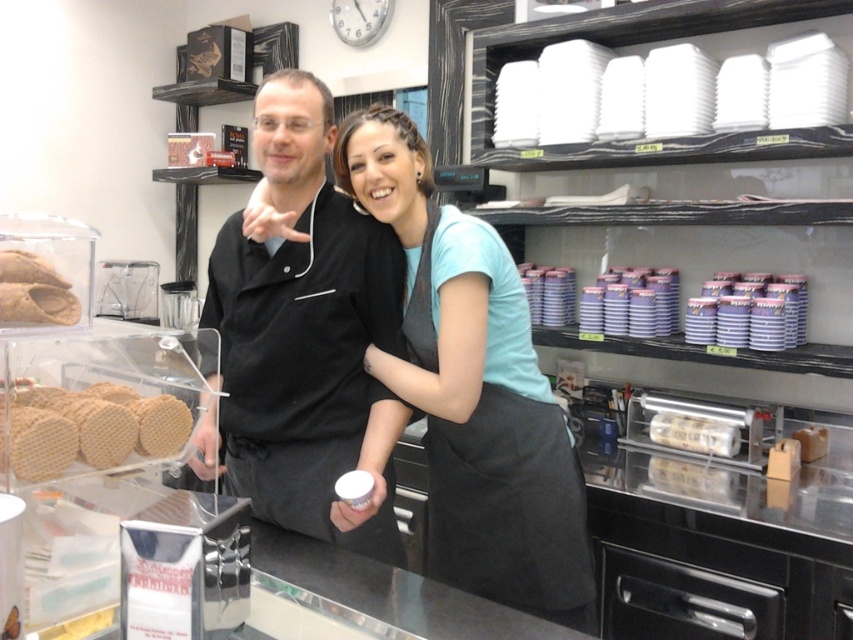
In the scene shown: Can you confirm if golden wafer at left is positioned below brown matte bread at center?

Incorrect, golden wafer at left is not positioned below brown matte bread at center.

Consider the image. Can you confirm if golden wafer at left is shorter than brown matte bread at center?

No, golden wafer at left is not shorter than brown matte bread at center.

Image resolution: width=853 pixels, height=640 pixels. What are the coordinates of `golden wafer at left` in the screenshot? It's located at (88, 428).

Locate an element on the screen. The width and height of the screenshot is (853, 640). golden wafer at left is located at coordinates (88, 428).

Can you confirm if translucent plastic bag at center is positioned above brown matte bread at center?

No.

What do you see at coordinates (688, 480) in the screenshot? Image resolution: width=853 pixels, height=640 pixels. I see `translucent plastic bag at center` at bounding box center [688, 480].

Is point (698, 470) positioned before point (801, 460)?

Yes, point (698, 470) is in front of point (801, 460).

Locate an element on the screen. This screenshot has height=640, width=853. translucent plastic bag at center is located at coordinates (688, 480).

Is point (380, 528) in front of point (471, 346)?

No.

Does black matte shirt at center come behind light blue fabric apron at center?

No, black matte shirt at center is in front of light blue fabric apron at center.

I want to click on black matte shirt at center, so click(x=306, y=337).